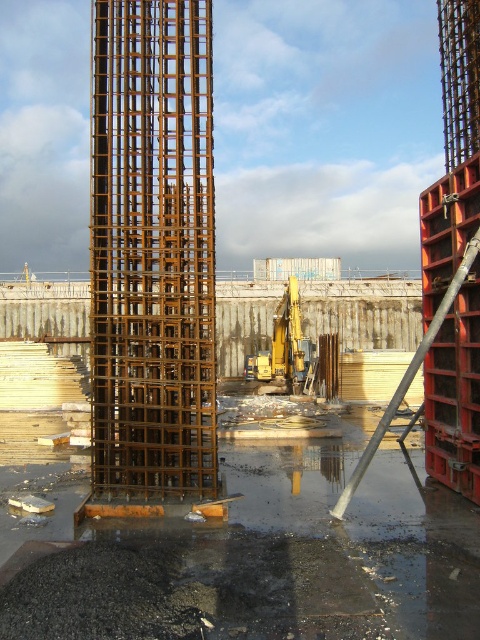
You are an engineer inspecting the construction site. You notice the rusty metal tower at left and the yellow metallic excavator at center. From your vantage point, which object is positioned higher in the image?

The rusty metal tower at left is positioned higher than the yellow metallic excavator at center in the image.

You are a construction worker needing to move a heavy equipment that requires a space larger than the rusty metal tower at left. Can the yellow metallic excavator at center be moved into that space?

The rusty metal tower at left has a smaller size compared to yellow metallic excavator at center. Therefore, the yellow metallic excavator at center cannot fit into the space intended for the rusty metal tower at left since it is larger in size.